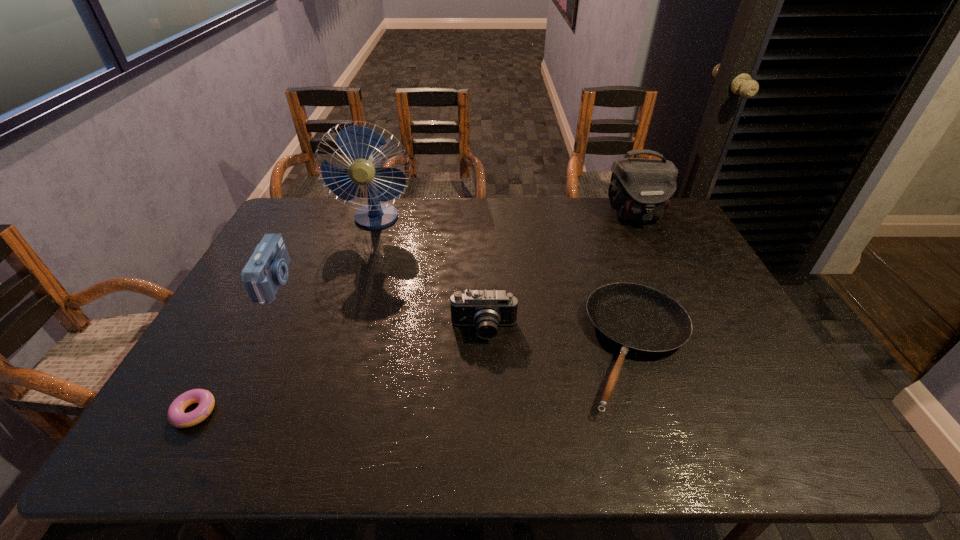
Identify which object is located as the third nearest to the nearer camera. Please provide its 2D coordinates. Your answer should be formatted as a tuple, i.e. [(x, y)], where the tuple contains the x and y coordinates of a point satisfying the conditions above.

[(267, 269)]

Find the location of a particular element. This screenshot has width=960, height=540. vacant space that satisfies the following two spatial constraints: 1. at the front of the tallest object where the blades are visible; 2. on the right side of the frying pan is located at coordinates (335, 348).